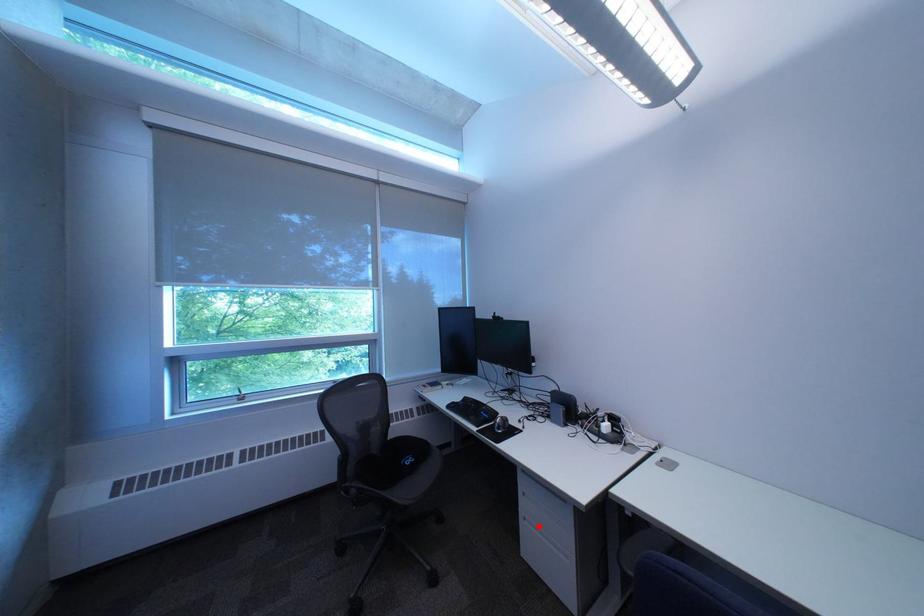
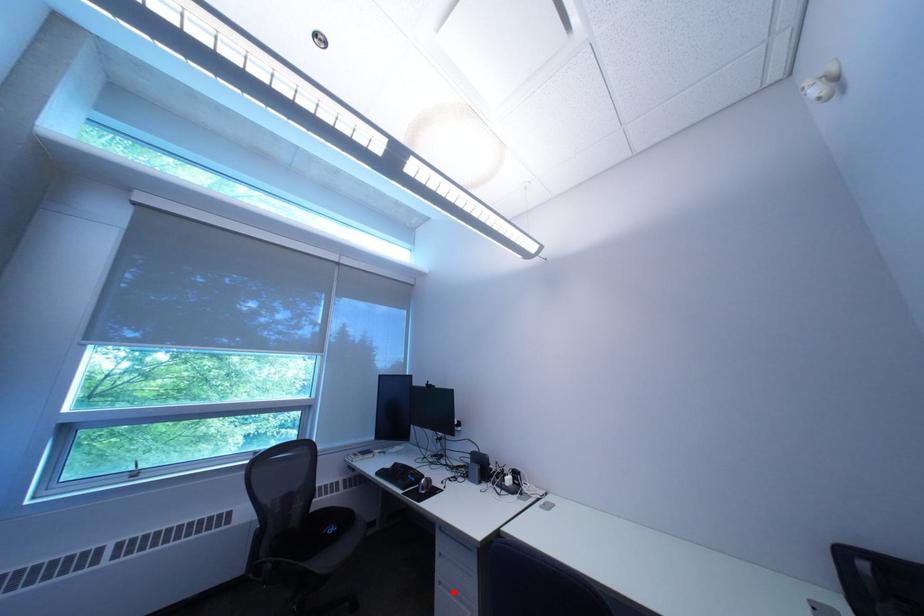
I am providing you with two images of the same scene from different viewpoints. A red point is marked on the first image and another point is marked on the second image. Are the points marked in image1 and image2 representing the same 3D position?

Yes